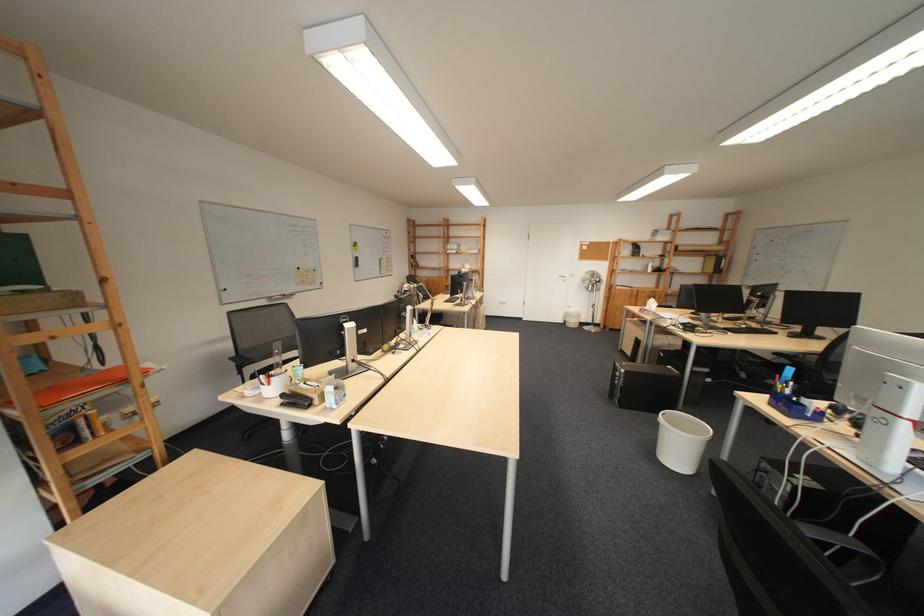
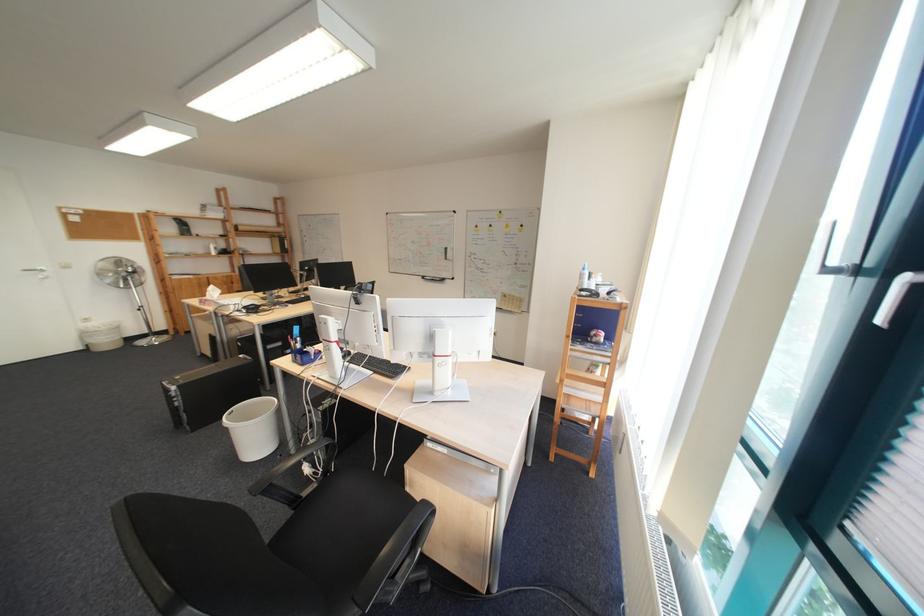
Where in the second image is the point corresponding to (672,427) from the first image?

(239, 430)